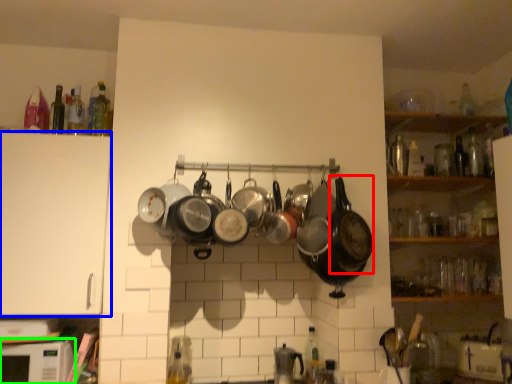
Question: Estimate the real-world distances between objects in this image. Which object is closer to wok (highlighted by a red box), cabinetry (highlighted by a blue box) or microwave (highlighted by a green box)?

Choices:
 (A) cabinetry
 (B) microwave

Answer: (A)